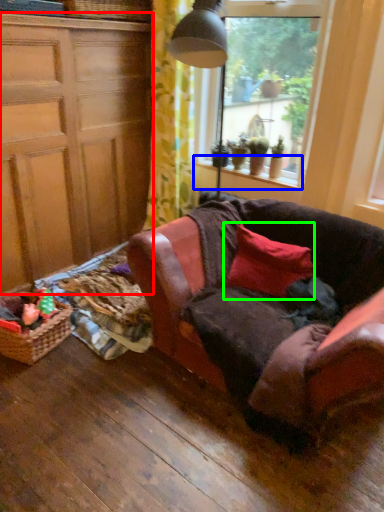
Question: Which is nearer to the cabinetry (highlighted by a red box)? window sill (highlighted by a blue box) or pillow (highlighted by a green box).

Choices:
 (A) window sill
 (B) pillow

Answer: (A)